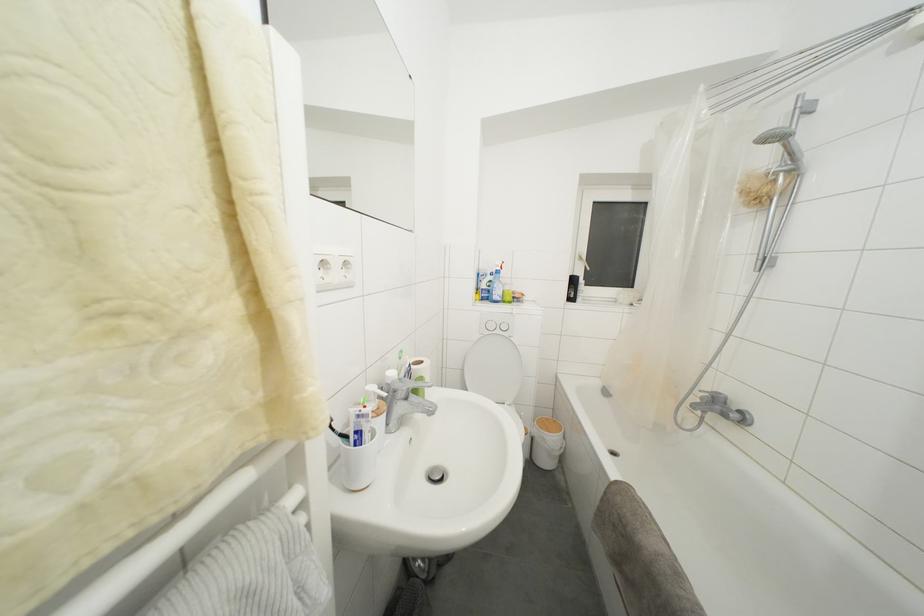
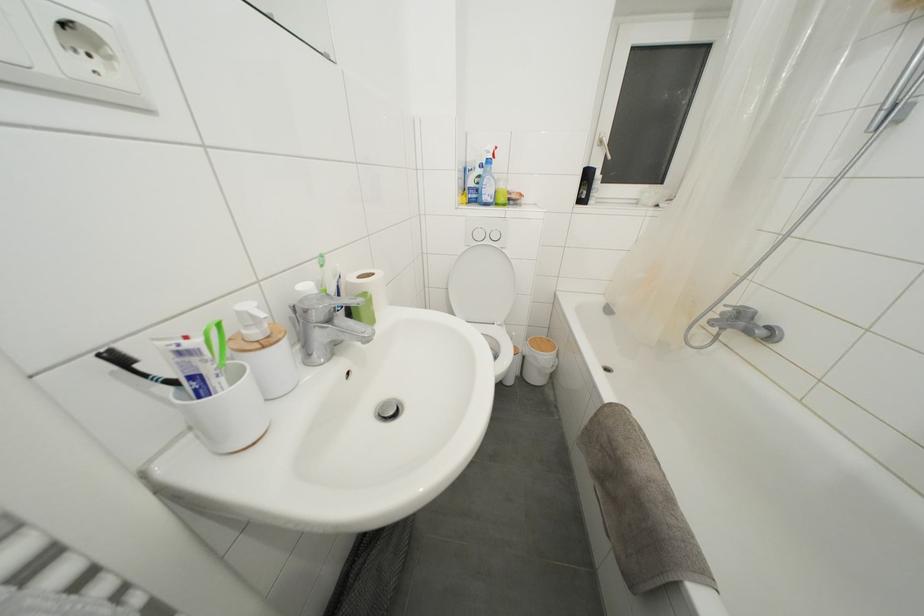
In the second image, find the point that corresponds to (x=337, y=435) in the first image.

(150, 381)